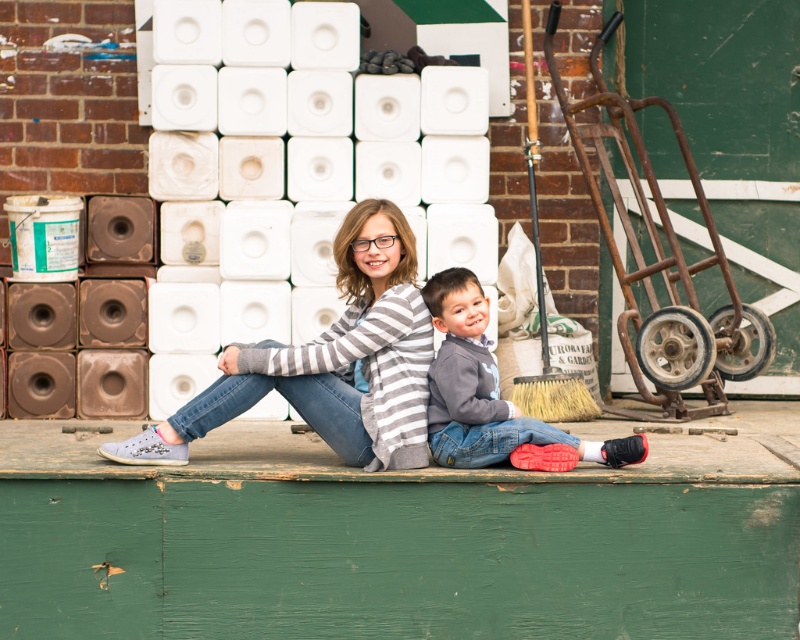
Between green painted wood at center and gray fleece sweater at center, which one is positioned lower?

Positioned lower is green painted wood at center.

In the scene shown: Who is positioned more to the left, green painted wood at center or gray fleece sweater at center?

green painted wood at center is more to the left.

Does point (298, 552) come in front of point (546, 429)?

Yes, point (298, 552) is in front of point (546, 429).

Image resolution: width=800 pixels, height=640 pixels. Find the location of `green painted wood at center`. green painted wood at center is located at coordinates (398, 540).

What do you see at coordinates (398, 540) in the screenshot? I see `green painted wood at center` at bounding box center [398, 540].

Looking at this image, does green painted wood at center appear on the right side of striped sweater at center?

Correct, you'll find green painted wood at center to the right of striped sweater at center.

Is point (289, 552) more distant than point (249, 365)?

No, it is not.

Where is `green painted wood at center`? green painted wood at center is located at coordinates (398, 540).

Which is more to the left, striped sweater at center or gray fleece sweater at center?

Positioned to the left is striped sweater at center.

Image resolution: width=800 pixels, height=640 pixels. Describe the element at coordinates (332, 362) in the screenshot. I see `striped sweater at center` at that location.

The image size is (800, 640). Find the location of `striped sweater at center`. striped sweater at center is located at coordinates click(x=332, y=362).